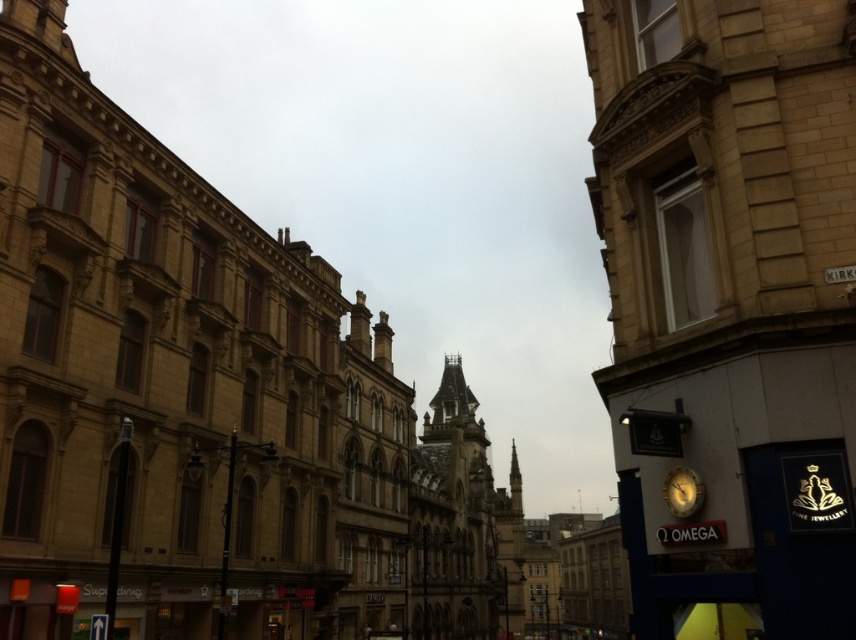
Question: Can you confirm if stone gothic tower at center is thinner than gold metallic clock at center right?

Choices:
 (A) yes
 (B) no

Answer: (B)

Question: Which of the following is the farthest from the observer?

Choices:
 (A) gold metallic clock at center right
 (B) stone gothic tower at center

Answer: (B)

Question: Which object appears farthest from the camera in this image?

Choices:
 (A) gold metallic clock at center right
 (B) stone gothic tower at center

Answer: (B)

Question: Can you confirm if stone gothic tower at center is positioned below gold metallic clock at center right?

Choices:
 (A) no
 (B) yes

Answer: (B)

Question: Observing the image, what is the correct spatial positioning of stone gothic tower at center in reference to gold metallic clock at center right?

Choices:
 (A) above
 (B) below

Answer: (B)